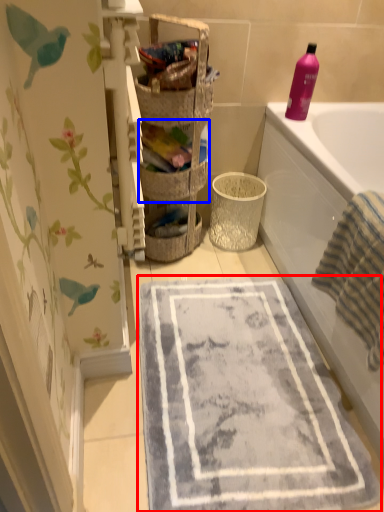
Question: Which object appears farthest to the camera in this image, bath mat (highlighted by a red box) or basket (highlighted by a blue box)?

Choices:
 (A) bath mat
 (B) basket

Answer: (B)